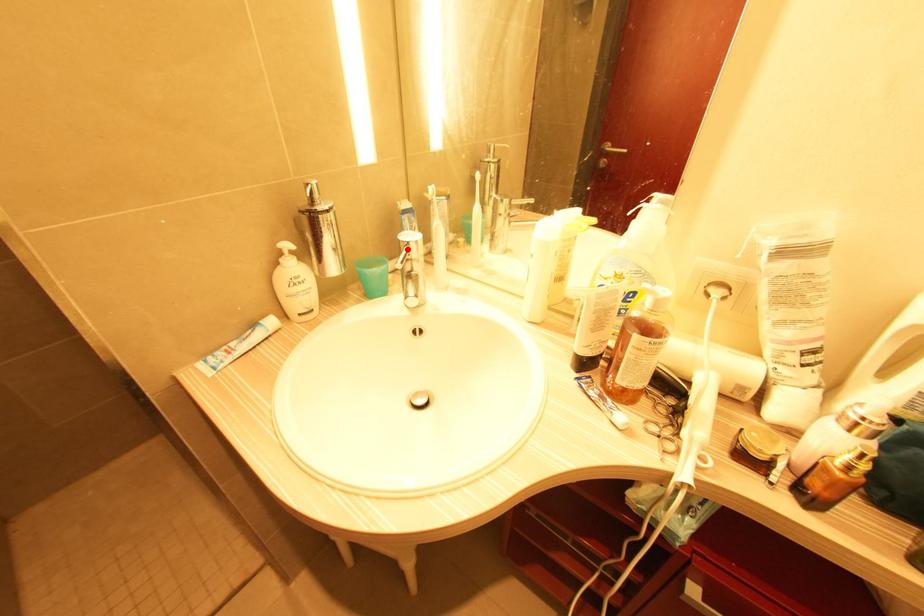
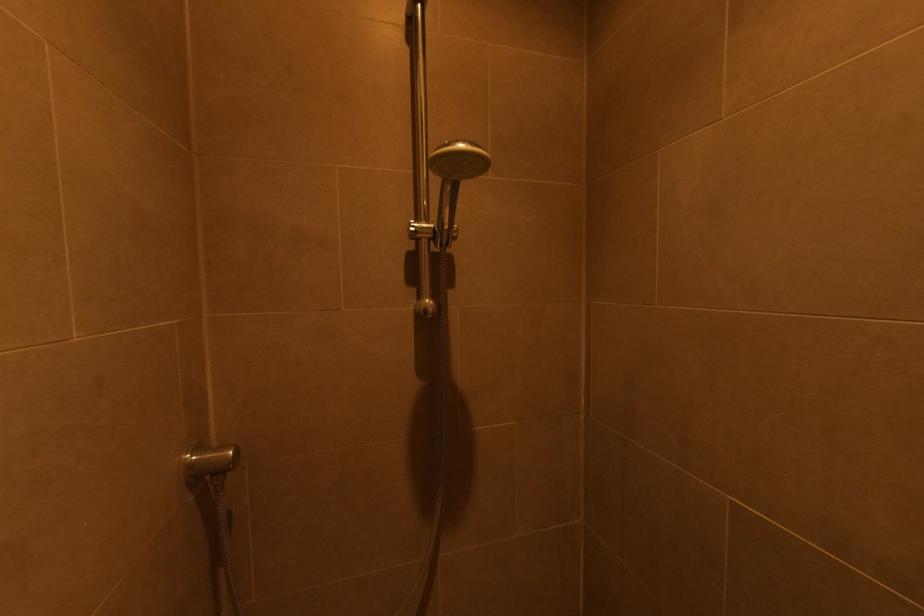
Question: I am providing you with two images of the same scene from different viewpoints. A red point is marked on the first image. At the location where the point appears in image 1, is it still visible in image 2?

Choices:
 (A) Yes
 (B) No

Answer: (B)